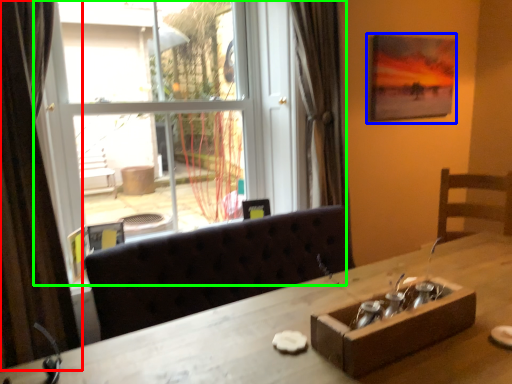
Question: Estimate the real-world distances between objects in this image. Which object is farther from curtain (highlighted by a red box), picture frame (highlighted by a blue box) or window (highlighted by a green box)?

Choices:
 (A) picture frame
 (B) window

Answer: (A)